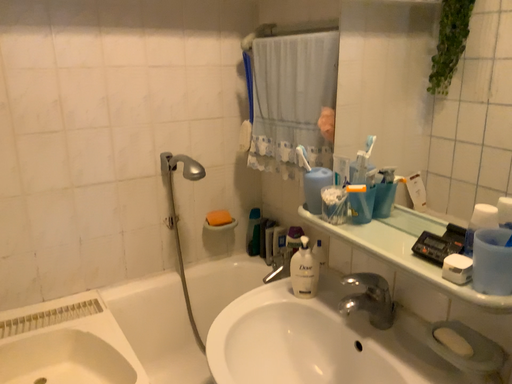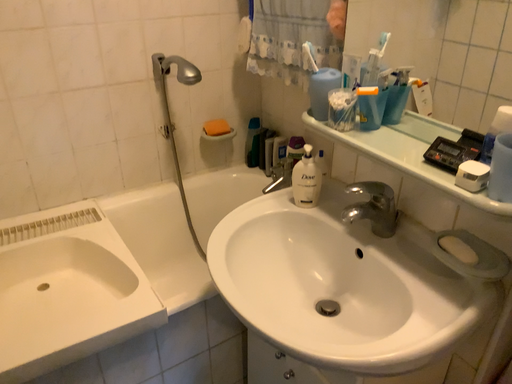
Question: Which way did the camera rotate in the video?

Choices:
 (A) rotated upward
 (B) rotated downward

Answer: (B)